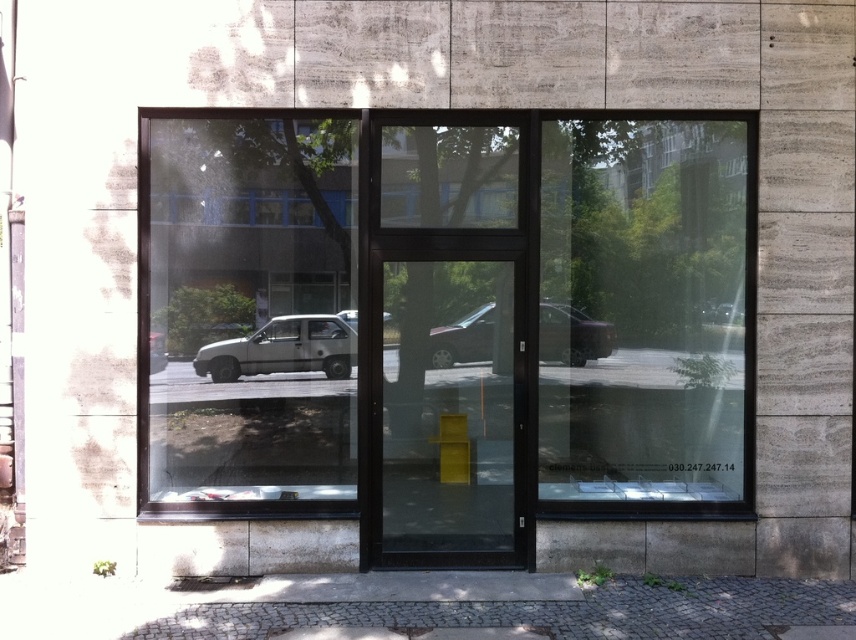
You are standing in front of the building and want to take a photo of the silver metallic car at center without including the transparent glass window at left in the frame. Is it possible to do so by adjusting your position?

The transparent glass window at left is located above the silver metallic car at center, so if you move to a position where the car is framed without looking upward, you can exclude the window from the photo.

You are a delivery person approaching the building and see the transparent glass door at center and the silver metallic car at center. Which object is closer to you as you walk towards the building?

The transparent glass door at center is closer to you because it is in front of the silver metallic car at center, meaning the car is behind the door from your perspective.

You are standing in front of the building and want to see the silver metallic car at center through the transparent glass window at left. Is the car visible in the reflection of the window?

The transparent glass window at left is in front of the silver metallic car at center, so the car is likely visible in the reflection of the window because the window is reflecting the environment around it, including the car.